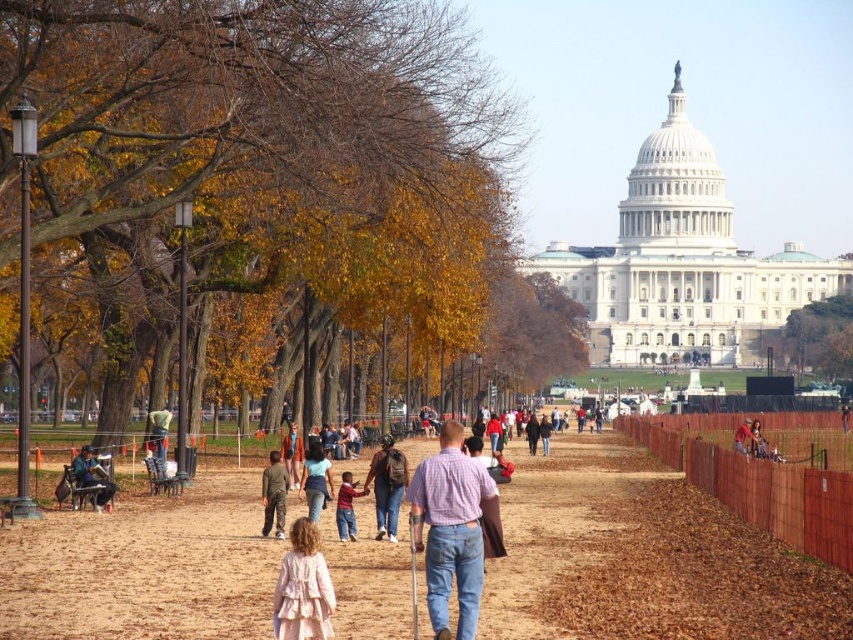
Can you confirm if green leafy tree at center-right is shorter than khaki pants at center?

Incorrect, green leafy tree at center-right's height does not fall short of khaki pants at center's.

Which is in front, point (793, 358) or point (283, 509)?

Point (283, 509)

You are a GUI agent. You are given a task and a screenshot of the screen. Output one action in this format:
    pyautogui.click(x=<x>, y=<y>)
    Task: Click on the green leafy tree at center-right
    The width and height of the screenshot is (853, 640).
    Given the screenshot: What is the action you would take?
    pyautogui.click(x=817, y=339)

Can you confirm if pastel pink fabric dress at lower center is positioned to the right of khaki pants at center?

Correct, you'll find pastel pink fabric dress at lower center to the right of khaki pants at center.

Does pastel pink fabric dress at lower center appear on the left side of khaki pants at center?

Incorrect, pastel pink fabric dress at lower center is not on the left side of khaki pants at center.

The width and height of the screenshot is (853, 640). I want to click on pastel pink fabric dress at lower center, so tap(303, 588).

Who is positioned more to the left, pastel pink fabric dress at lower center or green leafy tree at center-right?

Positioned to the left is pastel pink fabric dress at lower center.

Can you confirm if pastel pink fabric dress at lower center is taller than green leafy tree at center-right?

In fact, pastel pink fabric dress at lower center may be shorter than green leafy tree at center-right.

Which is behind, point (281, 589) or point (833, 356)?

The point (833, 356) is more distant.

Find the location of a particular element. The height and width of the screenshot is (640, 853). pastel pink fabric dress at lower center is located at coordinates (303, 588).